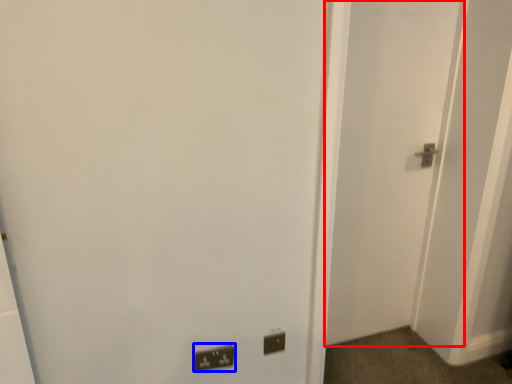
Question: Among these objects, which one is nearest to the camera, door (highlighted by a red box) or light switch (highlighted by a blue box)?

Choices:
 (A) door
 (B) light switch

Answer: (A)